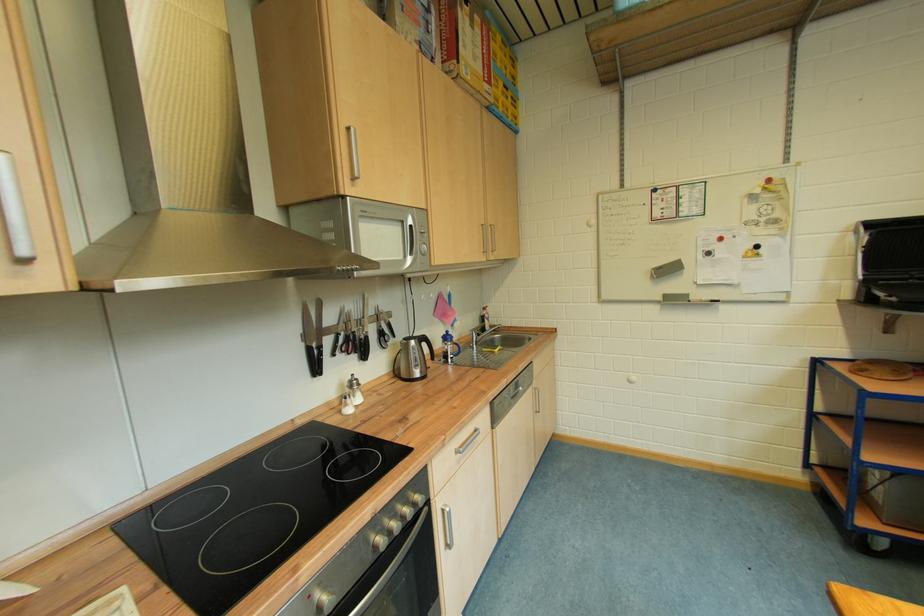
Locate an element on the screen. round wooden board is located at coordinates (886, 370).